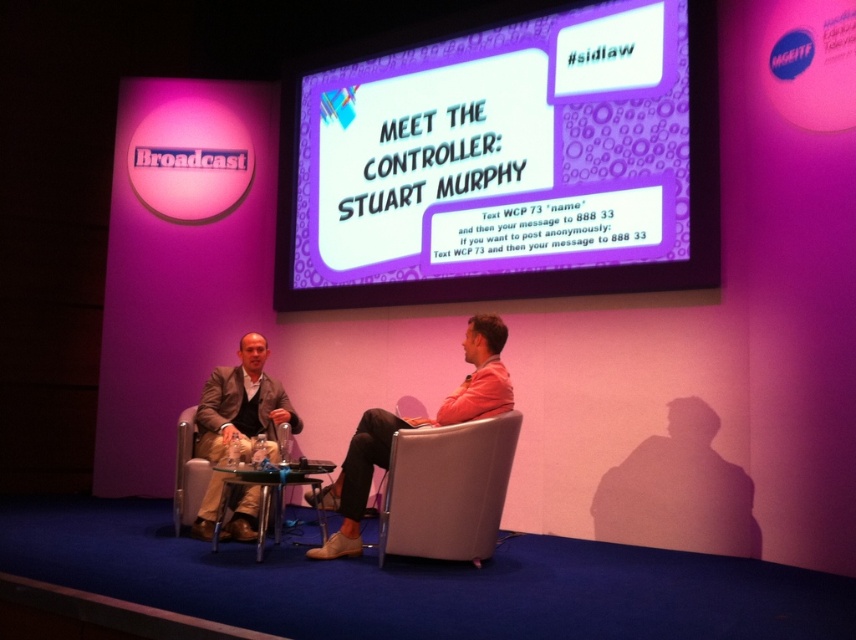
Question: Which point is farther to the camera?

Choices:
 (A) leather at right
 (B) purple glossy projection screen at upper center

Answer: (B)

Question: From the image, what is the correct spatial relationship of purple glossy projection screen at upper center in relation to leather at right?

Choices:
 (A) left
 (B) right

Answer: (B)

Question: Is pink fabric chair at center to the right of metallic silver chair at center from the viewer's perspective?

Choices:
 (A) yes
 (B) no

Answer: (A)

Question: Considering the relative positions of leather at right and metallic silver chair at center in the image provided, where is leather at right located with respect to metallic silver chair at center?

Choices:
 (A) right
 (B) left

Answer: (A)

Question: Which point is closer to the camera taking this photo?

Choices:
 (A) (382, 419)
 (B) (195, 509)
 (C) (479, 426)
 (D) (456, 72)

Answer: (C)

Question: Which point appears farthest from the camera in this image?

Choices:
 (A) (376, 449)
 (B) (467, 451)
 (C) (455, 214)

Answer: (C)